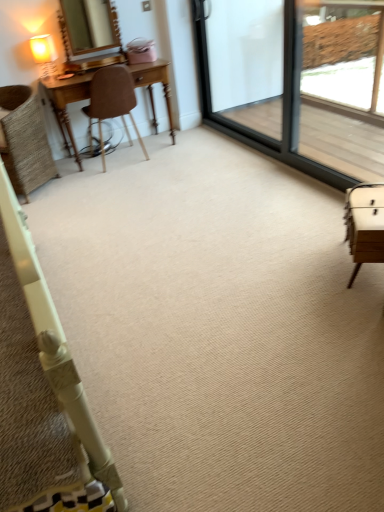
The image size is (384, 512). What do you see at coordinates (90, 25) in the screenshot? I see `matte gold mirror at upper left` at bounding box center [90, 25].

This screenshot has width=384, height=512. Identify the location of wooden desk at left. (69, 102).

What do you see at coordinates (69, 102) in the screenshot?
I see `wooden desk at left` at bounding box center [69, 102].

The height and width of the screenshot is (512, 384). Identify the location of brown leather chair at left, arranged as the 1th chair when viewed from the right. (112, 102).

Image resolution: width=384 pixels, height=512 pixels. What do you see at coordinates (112, 102) in the screenshot?
I see `brown leather chair at left, arranged as the 1th chair when viewed from the right` at bounding box center [112, 102].

I want to click on transparent glass screen door at upper right, which appears as the second screen door when viewed from the right, so click(242, 66).

Looking at their sizes, would you say clear glass screen door at upper right, positioned as the second screen door in left-to-right order, is wider or thinner than wooden desk at left?

Clearly, clear glass screen door at upper right, positioned as the second screen door in left-to-right order, has less width compared to wooden desk at left.

Is clear glass screen door at upper right, positioned as the second screen door in left-to-right order, situated inside wooden desk at left or outside?

clear glass screen door at upper right, positioned as the second screen door in left-to-right order, lies outside wooden desk at left.

Is point (346, 183) positioned behind point (146, 64)?

That is False.

Between clear glass screen door at upper right, positioned as the first screen door in right-to-left order, and wooden desk at left, which one has less height?

wooden desk at left.

From the image's perspective, which one is positioned lower, wooden desk at left or woven wicker chair at left, the second chair positioned from the right?

From the image's view, woven wicker chair at left, the second chair positioned from the right, is below.

Is wooden desk at left inside or outside of woven wicker chair at left, the 1th chair viewed from the left?

wooden desk at left is not enclosed by woven wicker chair at left, the 1th chair viewed from the left.

Consider the image. Could you tell me if wooden desk at left is facing woven wicker chair at left, the second chair positioned from the right?

No, wooden desk at left is not aimed at woven wicker chair at left, the second chair positioned from the right.

How far apart are wooden desk at left and woven wicker chair at left, the second chair positioned from the right?

wooden desk at left and woven wicker chair at left, the second chair positioned from the right, are 22.63 inches apart from each other.

Between point (221, 42) and point (110, 3), which one is positioned in front?

Positioned in front is point (110, 3).

Is clear glass screen door at upper right, positioned as the first screen door in right-to-left order, turned away from matte gold mirror at upper left?

No, clear glass screen door at upper right, positioned as the first screen door in right-to-left order, is not facing the opposite direction of matte gold mirror at upper left.

Is clear glass screen door at upper right, positioned as the first screen door in right-to-left order, next to matte gold mirror at upper left?

No, clear glass screen door at upper right, positioned as the first screen door in right-to-left order, is not touching matte gold mirror at upper left.

Can you confirm if clear glass screen door at upper right, positioned as the second screen door in left-to-right order, is bigger than matte gold mirror at upper left?

Yes, clear glass screen door at upper right, positioned as the second screen door in left-to-right order, is bigger than matte gold mirror at upper left.

At what (x,y) coordinates should I click in order to perform the action: click on mirror located on the left of clear glass screen door at upper right, positioned as the second screen door in left-to-right order. Please return your answer as a coordinate pair (x, y). Looking at the image, I should click on (90, 25).

Can you confirm if matte gold mirror at upper left is positioned to the right of clear glass screen door at upper right, positioned as the first screen door in right-to-left order?

No, matte gold mirror at upper left is not to the right of clear glass screen door at upper right, positioned as the first screen door in right-to-left order.

What's the angular difference between matte gold mirror at upper left and clear glass screen door at upper right, positioned as the first screen door in right-to-left order,'s facing directions?

89.7 degrees.

Who is smaller, matte gold mirror at upper left or clear glass screen door at upper right, positioned as the second screen door in left-to-right order?

matte gold mirror at upper left is smaller.

Are woven wicker chair at left, the 1th chair viewed from the left, and wooden desk at left beside each other?

No, woven wicker chair at left, the 1th chair viewed from the left, is not next to wooden desk at left.

Is woven wicker chair at left, the 1th chair viewed from the left, closer to camera compared to wooden desk at left?

Yes, it is.

Does point (22, 106) appear closer or farther from the camera than point (52, 104)?

Point (22, 106) appears to be closer to the viewer than point (52, 104).

Can you confirm if woven wicker chair at left, the 1th chair viewed from the left, is wider than wooden desk at left?

Yes, woven wicker chair at left, the 1th chair viewed from the left, is wider than wooden desk at left.

Is transparent glass screen door at upper right, which appears as the second screen door when viewed from the right, wider than woven wicker chair at left, the second chair positioned from the right?

In fact, transparent glass screen door at upper right, which appears as the second screen door when viewed from the right, might be narrower than woven wicker chair at left, the second chair positioned from the right.

How different are the orientations of transparent glass screen door at upper right, which appears as the second screen door when viewed from the right, and woven wicker chair at left, the 1th chair viewed from the left, in degrees?

The angular difference between transparent glass screen door at upper right, which appears as the second screen door when viewed from the right, and woven wicker chair at left, the 1th chair viewed from the left, is 42.3 degrees.

Which of these two, transparent glass screen door at upper right, positioned as the 1th screen door in left-to-right order, or woven wicker chair at left, the second chair positioned from the right, stands shorter?

With less height is woven wicker chair at left, the second chair positioned from the right.

Is transparent glass screen door at upper right, positioned as the 1th screen door in left-to-right order, oriented towards clear glass screen door at upper right, positioned as the second screen door in left-to-right order?

Yes, transparent glass screen door at upper right, positioned as the 1th screen door in left-to-right order, is aimed at clear glass screen door at upper right, positioned as the second screen door in left-to-right order.

Is transparent glass screen door at upper right, positioned as the 1th screen door in left-to-right order, not near clear glass screen door at upper right, positioned as the first screen door in right-to-left order?

transparent glass screen door at upper right, positioned as the 1th screen door in left-to-right order, is actually quite close to clear glass screen door at upper right, positioned as the first screen door in right-to-left order.

Is transparent glass screen door at upper right, which appears as the second screen door when viewed from the right, located outside clear glass screen door at upper right, positioned as the second screen door in left-to-right order?

No, most part of transparent glass screen door at upper right, which appears as the second screen door when viewed from the right, lies within clear glass screen door at upper right, positioned as the second screen door in left-to-right order.

Can you confirm if transparent glass screen door at upper right, which appears as the second screen door when viewed from the right, is positioned to the left of clear glass screen door at upper right, positioned as the second screen door in left-to-right order?

Indeed, transparent glass screen door at upper right, which appears as the second screen door when viewed from the right, is positioned on the left side of clear glass screen door at upper right, positioned as the second screen door in left-to-right order.

The image size is (384, 512). I want to click on table behind the clear glass screen door at upper right, positioned as the first screen door in right-to-left order, so click(x=69, y=102).

Locate an element on the screen. Image resolution: width=384 pixels, height=512 pixels. table located underneath the woven wicker chair at left, the second chair positioned from the right (from a real-world perspective) is located at coordinates (69, 102).

Looking at the image, which one is located closer to matte gold mirror at upper left, matte cream table lamp at upper left or brown leather chair at left, arranged as the 1th chair when viewed from the right?

matte cream table lamp at upper left is positioned closer to the anchor matte gold mirror at upper left.

Which object lies nearer to the anchor point matte cream table lamp at upper left, wooden desk at left or woven wicker chair at left, the second chair positioned from the right?

Among the two, wooden desk at left is located nearer to matte cream table lamp at upper left.

From the image, which object appears to be farther from matte cream table lamp at upper left, wooden desk at left or clear glass screen door at upper right, positioned as the first screen door in right-to-left order?

Among the two, clear glass screen door at upper right, positioned as the first screen door in right-to-left order, is located further to matte cream table lamp at upper left.

Looking at this image, considering their positions, is matte gold mirror at upper left positioned closer to matte cream table lamp at upper left than clear glass screen door at upper right, positioned as the second screen door in left-to-right order?

The object closer to matte cream table lamp at upper left is matte gold mirror at upper left.

Based on their spatial positions, is woven wicker chair at left, the second chair positioned from the right, or matte cream table lamp at upper left further from brown leather chair at left, placed as the 2th chair when sorted from left to right?

matte cream table lamp at upper left lies further to brown leather chair at left, placed as the 2th chair when sorted from left to right, than the other object.

Based on their spatial positions, is woven wicker chair at left, the 1th chair viewed from the left, or brown leather chair at left, arranged as the 1th chair when viewed from the right, further from clear glass screen door at upper right, positioned as the first screen door in right-to-left order?

Based on the image, woven wicker chair at left, the 1th chair viewed from the left, appears to be further to clear glass screen door at upper right, positioned as the first screen door in right-to-left order.

Which object lies nearer to the anchor point woven wicker chair at left, the 1th chair viewed from the left, clear glass screen door at upper right, positioned as the second screen door in left-to-right order, or brown leather chair at left, arranged as the 1th chair when viewed from the right?

Based on the image, brown leather chair at left, arranged as the 1th chair when viewed from the right, appears to be nearer to woven wicker chair at left, the 1th chair viewed from the left.

When comparing their distances from matte gold mirror at upper left, does transparent glass screen door at upper right, which appears as the second screen door when viewed from the right, or woven wicker chair at left, the second chair positioned from the right, seem further?

transparent glass screen door at upper right, which appears as the second screen door when viewed from the right, is positioned further to the anchor matte gold mirror at upper left.

The image size is (384, 512). What are the coordinates of `chair between woven wicker chair at left, the second chair positioned from the right, and clear glass screen door at upper right, positioned as the first screen door in right-to-left order, in the horizontal direction` in the screenshot? It's located at (112, 102).

Where is `chair situated between matte gold mirror at upper left and clear glass screen door at upper right, positioned as the first screen door in right-to-left order, from left to right`? The height and width of the screenshot is (512, 384). chair situated between matte gold mirror at upper left and clear glass screen door at upper right, positioned as the first screen door in right-to-left order, from left to right is located at coordinates (112, 102).

At what (x,y) coordinates should I click in order to perform the action: click on table between matte cream table lamp at upper left and brown leather chair at left, arranged as the 1th chair when viewed from the right. Please return your answer as a coordinate pair (x, y). The image size is (384, 512). Looking at the image, I should click on (69, 102).

This screenshot has height=512, width=384. I want to click on table between woven wicker chair at left, the second chair positioned from the right, and clear glass screen door at upper right, positioned as the first screen door in right-to-left order, from left to right, so click(x=69, y=102).